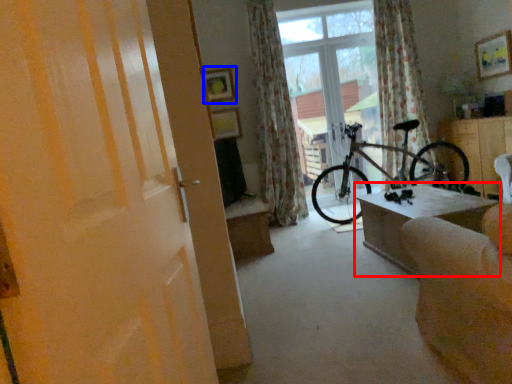
Question: Which object appears closest to the camera in this image, table (highlighted by a red box) or picture frame (highlighted by a blue box)?

Choices:
 (A) table
 (B) picture frame

Answer: (A)